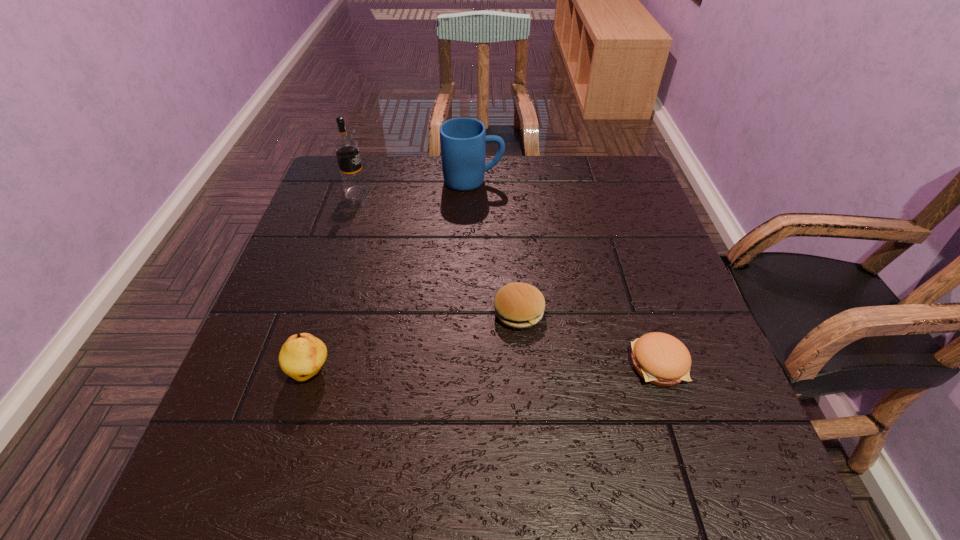
This screenshot has width=960, height=540. In order to click on blank area located on the back of the farther patty in this screenshot , I will do `click(514, 252)`.

Where is `vacant area located 0.380m on the left of the nearer patty`? The height and width of the screenshot is (540, 960). vacant area located 0.380m on the left of the nearer patty is located at coordinates (429, 364).

Find the location of a particular element. Image resolution: width=960 pixels, height=540 pixels. vodka present at the far edge is located at coordinates (346, 148).

The width and height of the screenshot is (960, 540). Find the location of `mug located in the far edge section of the desktop`. mug located in the far edge section of the desktop is located at coordinates (463, 140).

Where is `vodka at the left edge`? vodka at the left edge is located at coordinates (346, 148).

Find the location of a particular element. The height and width of the screenshot is (540, 960). pear located at the left edge is located at coordinates (302, 356).

Where is `object positioned at the right edge`? The width and height of the screenshot is (960, 540). object positioned at the right edge is located at coordinates (661, 359).

Locate an element on the screen. object that is positioned at the far left corner is located at coordinates (346, 148).

The height and width of the screenshot is (540, 960). In order to click on vacant area at the far edge of the desktop in this screenshot , I will do (x=582, y=190).

The image size is (960, 540). I want to click on vacant area at the near edge, so click(321, 511).